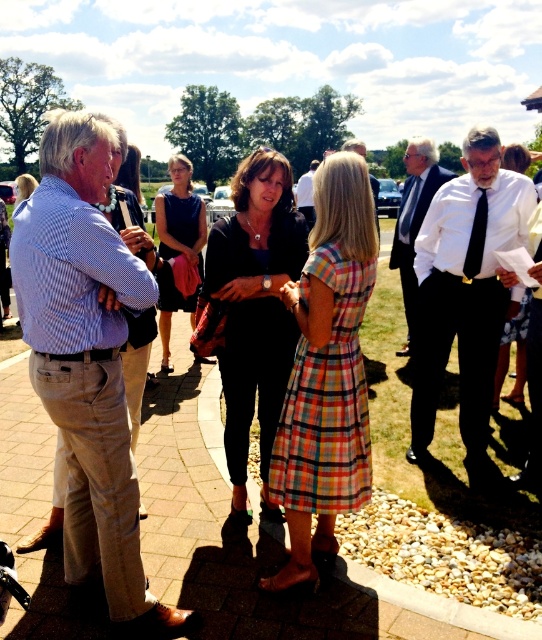
Between plaid cotton dress at center and plaid fabric dress at center, which one has more height?

With more height is plaid cotton dress at center.

Is point (366, 285) in front of point (501, 369)?

Yes.

Identify the location of plaid cotton dress at center. (326, 372).

Can you confirm if plaid cotton dress at center is smaller than dark blue tie at center?

Correct, plaid cotton dress at center occupies less space than dark blue tie at center.

Is plaid cotton dress at center positioned behind dark blue tie at center?

No.

Locate an element on the screen. plaid cotton dress at center is located at coordinates (326, 372).

The height and width of the screenshot is (640, 542). Identify the location of plaid cotton dress at center. (326, 372).

Does plaid cotton dress at center appear on the right side of matte black dress at center?

Yes, plaid cotton dress at center is to the right of matte black dress at center.

Between plaid cotton dress at center and matte black dress at center, which one appears on the right side from the viewer's perspective?

From the viewer's perspective, plaid cotton dress at center appears more on the right side.

The height and width of the screenshot is (640, 542). What are the coordinates of `plaid cotton dress at center` in the screenshot? It's located at (326, 372).